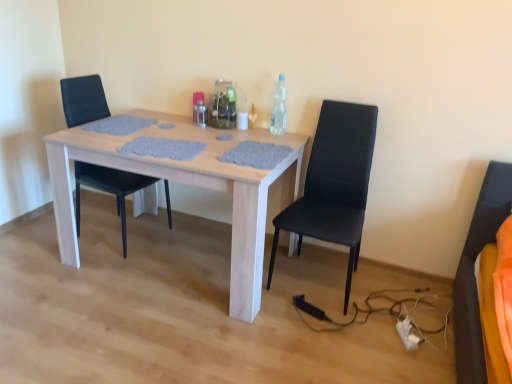
Where is `free space to the left of white fabric extension cord at lower right`? free space to the left of white fabric extension cord at lower right is located at coordinates (374, 337).